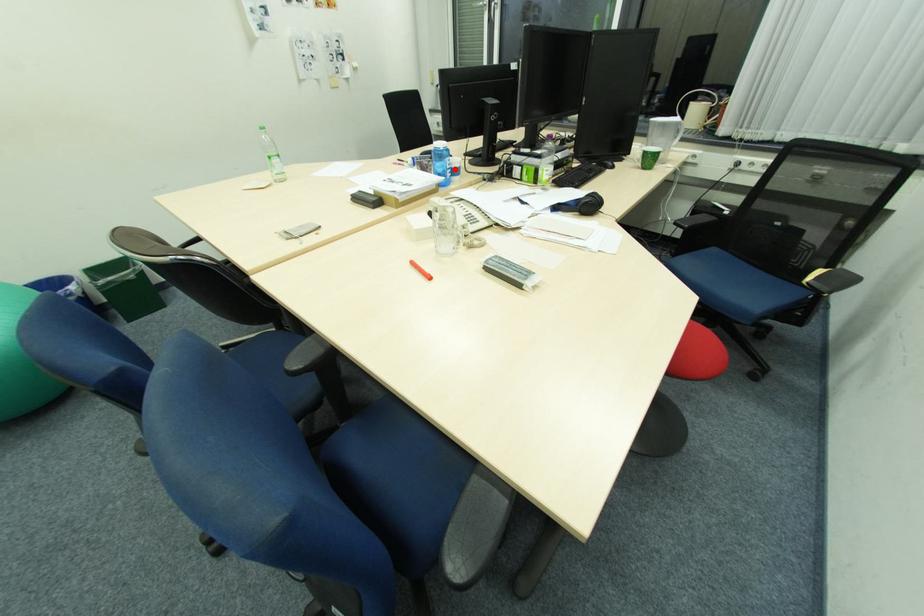
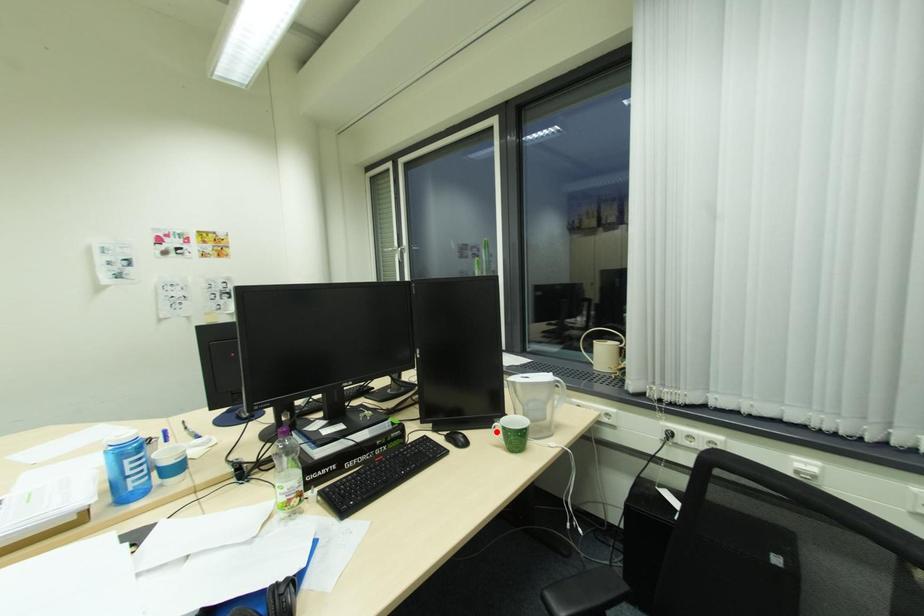
I am providing you with two images of the same scene from different viewpoints. A red point is marked on the first image and another point is marked on the second image. Does the point marked in image1 correspond to the same location as the one in image2?

No